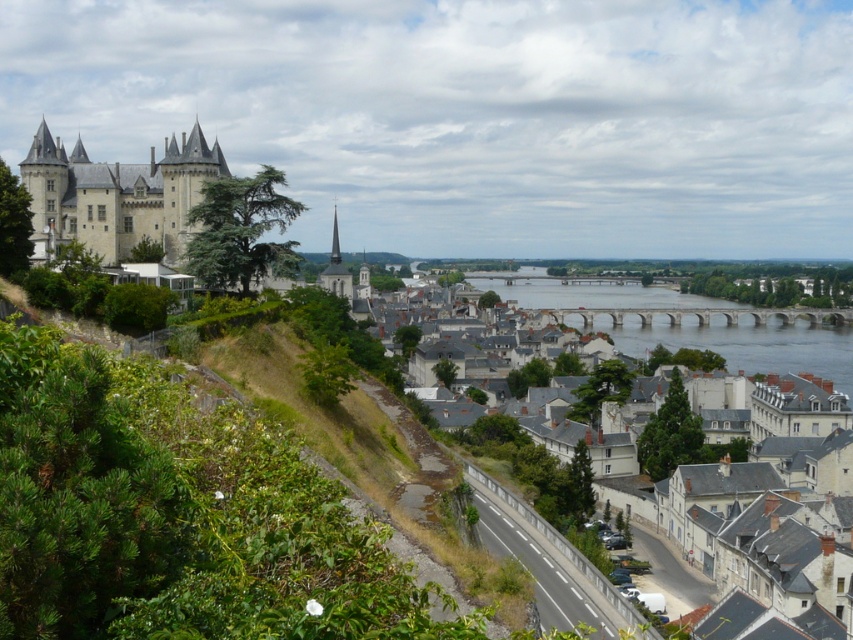
Is point (392, 298) positioned in front of point (776, 332)?

Yes, point (392, 298) is closer to viewer.

Locate an element on the screen. gray stone buildings at center is located at coordinates (453, 339).

Which is behind, point (701, 324) or point (111, 259)?

The point (701, 324) is more distant.

Between gray stone buildings at center and smooth stone castle at upper left, which one appears on the right side from the viewer's perspective?

Positioned to the right is gray stone buildings at center.

Image resolution: width=853 pixels, height=640 pixels. In order to click on gray stone buildings at center in this screenshot , I will do `click(453, 339)`.

This screenshot has height=640, width=853. I want to click on gray stone buildings at center, so click(x=453, y=339).

How distant is smooth stone castle at upper left from brown stone bridge at center?

smooth stone castle at upper left is 160.23 meters away from brown stone bridge at center.

Where is `smooth stone castle at upper left`? This screenshot has width=853, height=640. smooth stone castle at upper left is located at coordinates (115, 195).

Locate an element on the screen. The height and width of the screenshot is (640, 853). smooth stone castle at upper left is located at coordinates (115, 195).